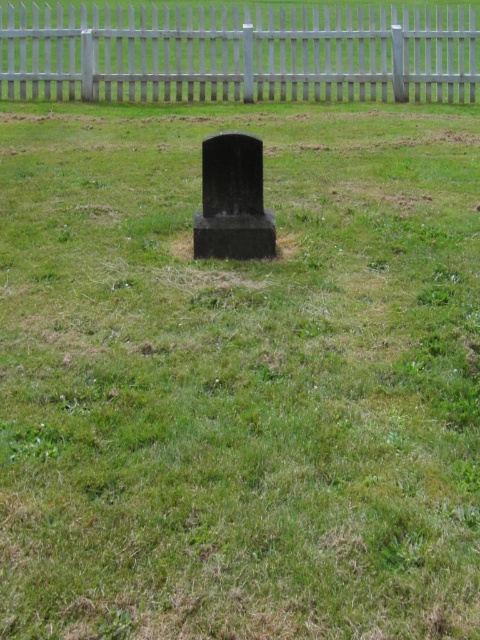
You are a landscape architect designing a memorial garden. You need to place a new decorative element between the white wooden fence at upper center and the black polished stone gravestone at center. Considering their thickness, which object should the new element be placed closer to?

The white wooden fence at upper center is thinner than the black polished stone gravestone at center, so the new decorative element should be placed closer to the white wooden fence at upper center to maintain balance between the two objects.

You are standing in front of the gravestone and want to place a small bouquet of flowers between the two points, point (74,33) and point (251,147). Which point should you place the bouquet closer to in order to have it appear closer to you?

You should place the bouquet closer to point (74,33) because it is closer to you than point (251,147).

You are standing at the edge of the grassy area near the small, solitary gravestone. You notice a white wooden fence at upper center. Based on its position, can you determine if the fence is closer to you or farther away compared to the gravestone?

The white wooden fence at upper center is located at point coordinates that do not provide depth information, so its distance relative to the gravestone cannot be determined solely from the given coordinates.